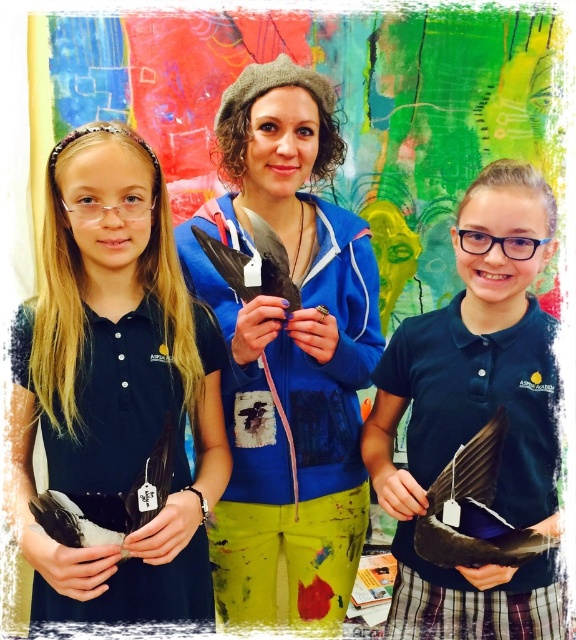
You are an art student observing the painting and the two matte black feathers in the scene. Which of the two feathers, the black matte feather at left or the matte black feather at right, is larger?

The matte black feather at right is larger than the black matte feather at left.

You are an art student in the studio and need to place a new sculpture exactly halfway between point A at point (354,326) and point B at point (501,253). Which point is closer to the sculpture? Please answer with either point A or point B.

The sculpture is placed exactly halfway between point A at point (354,326) and point B at point (501,253). Since both points are equidistant from the midpoint, neither is closer. However, according to the description, point A is behind point B, so the sculpture would be closer to point B.